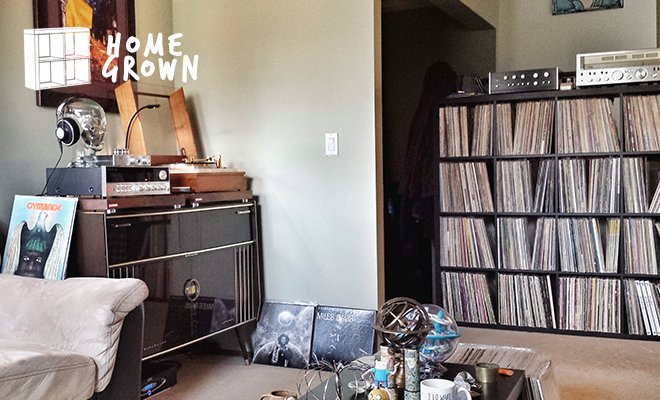
The height and width of the screenshot is (400, 660). What are the coordinates of `sofa` in the screenshot? It's located at (18, 360).